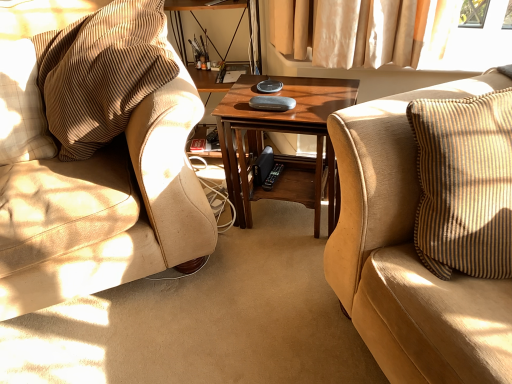
Find the location of a particular element. Image resolution: width=512 pixels, height=384 pixels. space that is in front of wooden coffee table at center is located at coordinates (273, 269).